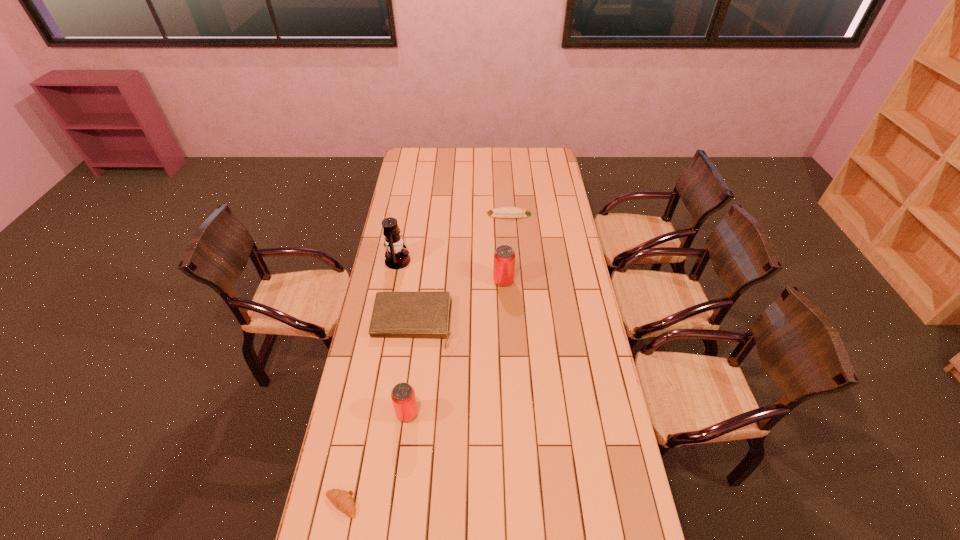
Image resolution: width=960 pixels, height=540 pixels. Find the location of `lantern that is at the left edge`. lantern that is at the left edge is located at coordinates (396, 258).

This screenshot has width=960, height=540. I want to click on crescent roll present at the left edge, so click(342, 500).

I want to click on object present at the near left corner, so click(342, 500).

Where is `free space at the far edge of the desktop`? This screenshot has height=540, width=960. free space at the far edge of the desktop is located at coordinates (451, 163).

Locate an element on the screen. vacant space at the left edge of the desktop is located at coordinates (392, 360).

In the image, there is a desktop. At what (x,y) coordinates should I click in order to perform the action: click on vacant space at the right edge. Please return your answer as a coordinate pair (x, y). The width and height of the screenshot is (960, 540). Looking at the image, I should click on pyautogui.click(x=574, y=342).

The height and width of the screenshot is (540, 960). Find the location of `vacant area at the far right corner of the desktop`. vacant area at the far right corner of the desktop is located at coordinates (551, 162).

The height and width of the screenshot is (540, 960). What are the coordinates of `empty space that is in between the burrito and the crescent roll` in the screenshot? It's located at (425, 359).

You are a GUI agent. You are given a task and a screenshot of the screen. Output one action in this format:
    pyautogui.click(x=<x>, y=<y>)
    Task: Click on the free space between the burrito and the crescent roll
    This screenshot has height=540, width=960.
    Given the screenshot: What is the action you would take?
    pyautogui.click(x=425, y=359)

I want to click on empty space that is in between the paperback book and the burrito, so click(461, 269).